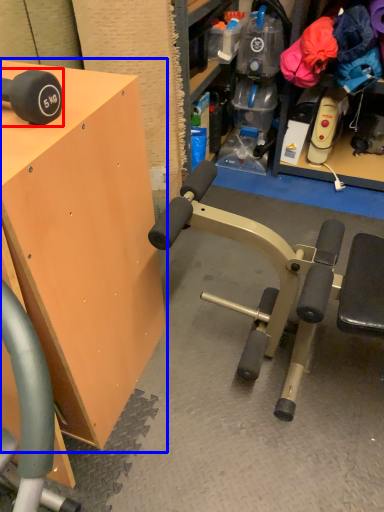
Question: Among these objects, which one is farthest to the camera, dumbbell (highlighted by a red box) or table (highlighted by a blue box)?

Choices:
 (A) dumbbell
 (B) table

Answer: (A)